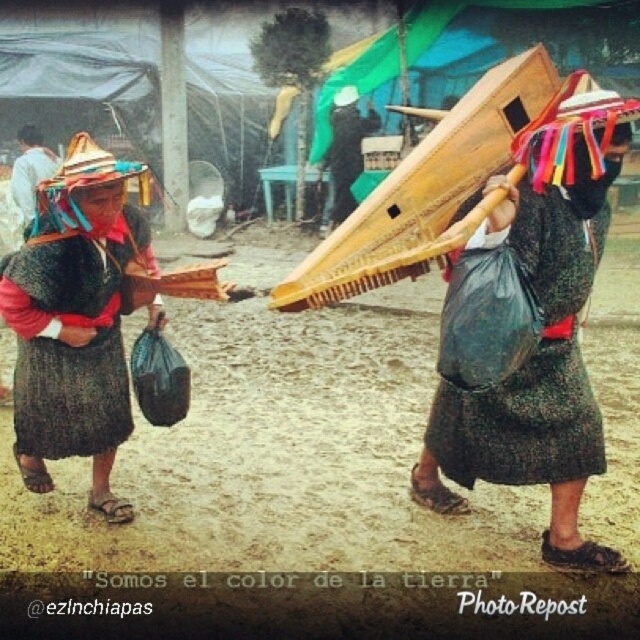
Who is more forward, (48, 237) or (44, 353)?

Point (48, 237)

Is point (33, 372) positioned behind point (48, 429)?

No, (33, 372) is in front of (48, 429).

Which is behind, point (60, 252) or point (100, 419)?

Positioned behind is point (100, 419).

At what (x,y) coordinates should I click in order to perform the action: click on matte black shawl at left. Please return your answer as a coordinate pair (x, y). This screenshot has height=640, width=640. Looking at the image, I should click on (74, 320).

Based on the photo, can you confirm if black textured dress at center is smaller than dark gray woven skirt at left?

No, black textured dress at center is not smaller than dark gray woven skirt at left.

Is point (564, 282) more distant than point (99, 444)?

That is False.

At what (x,y) coordinates should I click in order to perform the action: click on black textured dress at center. Please return your answer as a coordinate pair (x, y). This screenshot has height=640, width=640. Looking at the image, I should click on (x=534, y=364).

Does matte black shawl at left have a lesser height compared to black textured dress at center?

Incorrect, matte black shawl at left's height does not fall short of black textured dress at center's.

Can you confirm if matte black shawl at left is taller than black textured dress at center?

Indeed, matte black shawl at left has a greater height compared to black textured dress at center.

Measure the distance between matte black shawl at left and camera.

matte black shawl at left is 14.64 feet away from camera.

This screenshot has height=640, width=640. Identify the location of matte black shawl at left. (74, 320).